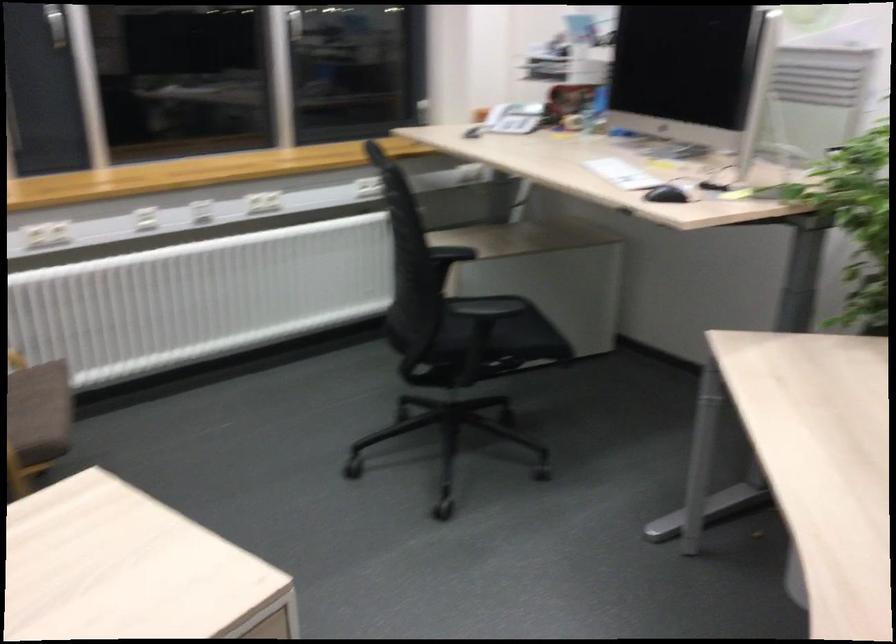
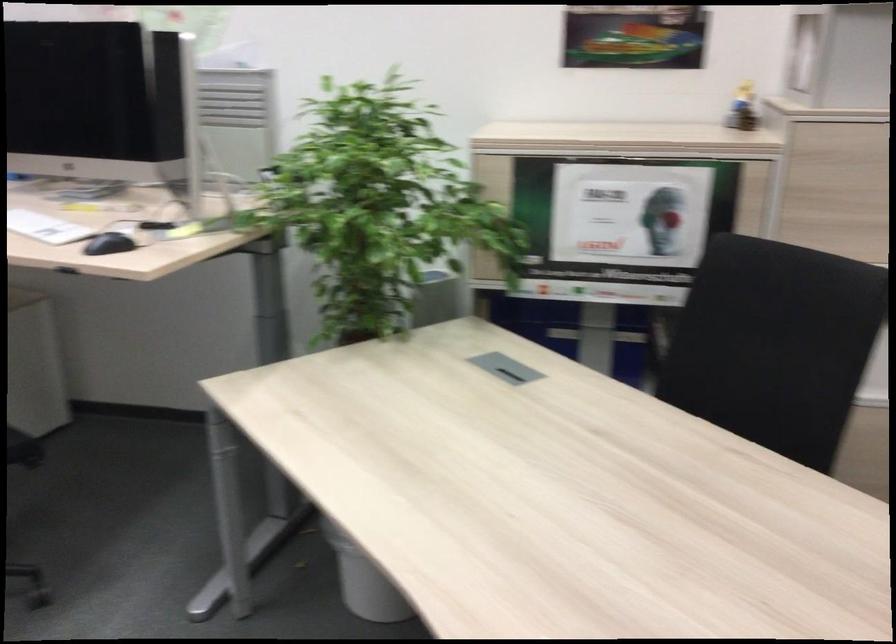
Question: The camera is either moving clockwise (left) or counter-clockwise (right) around the object. The first image is from the beginning of the video and the second image is from the end. Is the camera moving left or right when shooting the video?

Choices:
 (A) Left
 (B) Right

Answer: (A)